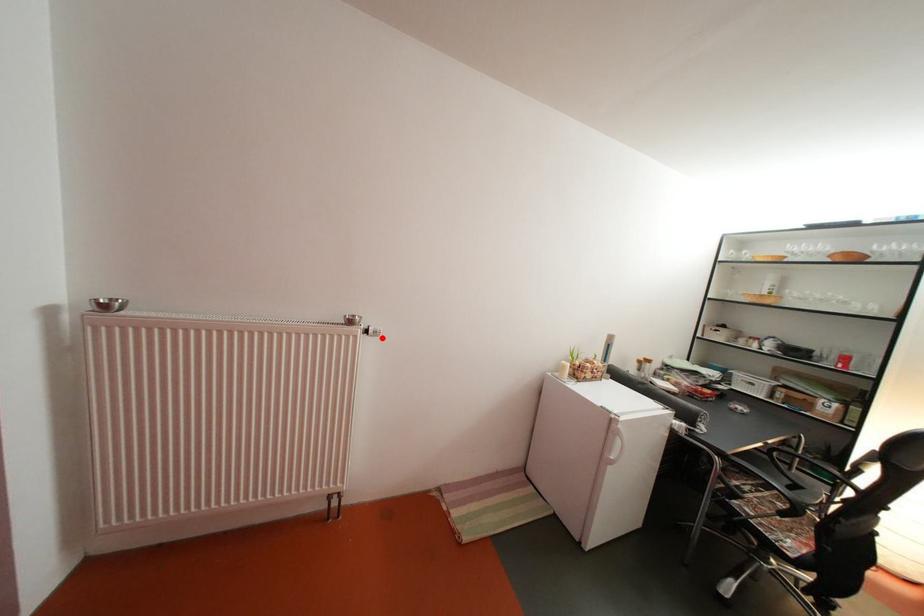
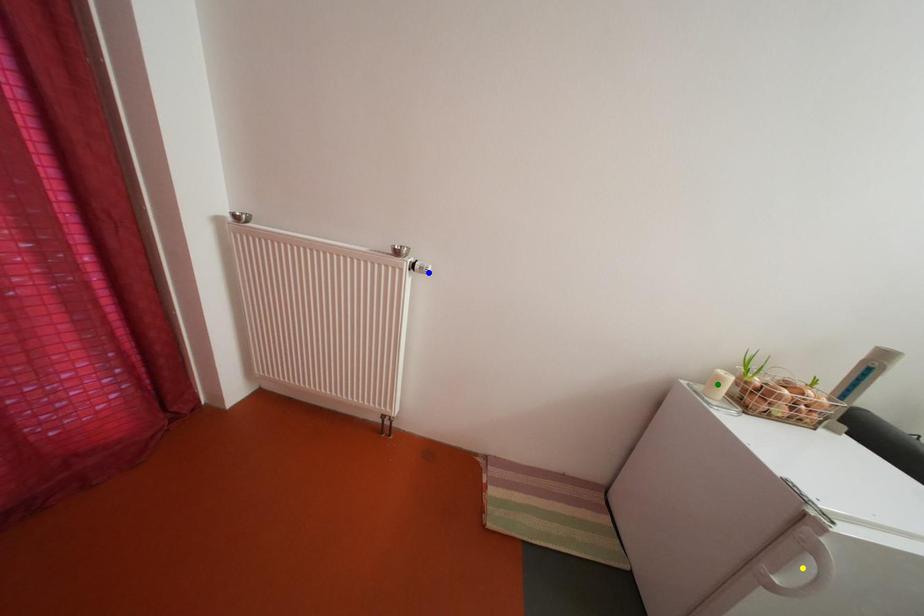
Question: I am providing you with two images of the same scene from different viewpoints. A red point is marked on the first image. You are given multiple points on the second image. Which mark in image 2 goes with the point in image 1?

Choices:
 (A) blue point
 (B) yellow point
 (C) green point

Answer: (A)